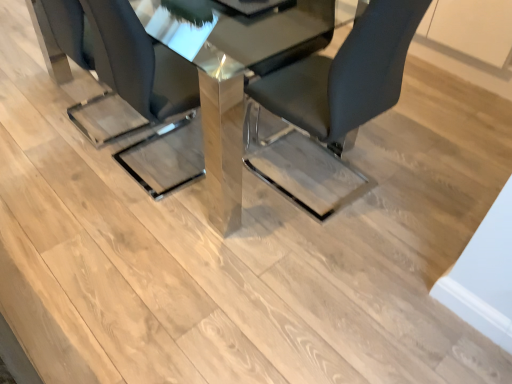
Question: Is matte black chair at center, arranged as the 1th chair when viewed from the left, at the left side of black leather chair at center, which ranks as the second chair in left-to-right order?

Choices:
 (A) yes
 (B) no

Answer: (A)

Question: Is black leather chair at center, which ranks as the second chair in left-to-right order, located within matte black chair at center, which appears as the 2th chair when viewed from the right?

Choices:
 (A) no
 (B) yes

Answer: (A)

Question: Does matte black chair at center, which appears as the 2th chair when viewed from the right, have a lesser height compared to black leather chair at center, which ranks as the 1th chair in right-to-left order?

Choices:
 (A) yes
 (B) no

Answer: (A)

Question: Is there a large distance between matte black chair at center, arranged as the 1th chair when viewed from the left, and black leather chair at center, which ranks as the second chair in left-to-right order?

Choices:
 (A) yes
 (B) no

Answer: (B)

Question: Can you confirm if matte black chair at center, which appears as the 2th chair when viewed from the right, is wider than black leather chair at center, which ranks as the second chair in left-to-right order?

Choices:
 (A) yes
 (B) no

Answer: (A)

Question: Is polished glass table at center taller or shorter than black leather chair at center, which ranks as the second chair in left-to-right order?

Choices:
 (A) short
 (B) tall

Answer: (A)

Question: From a real-world perspective, is polished glass table at center physically located above or below black leather chair at center, which ranks as the second chair in left-to-right order?

Choices:
 (A) below
 (B) above

Answer: (A)

Question: Would you say polished glass table at center is inside or outside black leather chair at center, which ranks as the 1th chair in right-to-left order?

Choices:
 (A) outside
 (B) inside

Answer: (A)

Question: Would you say polished glass table at center is to the left or to the right of black leather chair at center, which ranks as the 1th chair in right-to-left order, in the picture?

Choices:
 (A) left
 (B) right

Answer: (A)

Question: Is matte black chair at center, arranged as the 1th chair when viewed from the left, taller or shorter than polished glass table at center?

Choices:
 (A) short
 (B) tall

Answer: (B)

Question: Is matte black chair at center, arranged as the 1th chair when viewed from the left, wider or thinner than polished glass table at center?

Choices:
 (A) wide
 (B) thin

Answer: (B)

Question: Considering the positions of matte black chair at center, which appears as the 2th chair when viewed from the right, and polished glass table at center in the image, is matte black chair at center, which appears as the 2th chair when viewed from the right, bigger or smaller than polished glass table at center?

Choices:
 (A) big
 (B) small

Answer: (B)

Question: Choose the correct answer: Is matte black chair at center, which appears as the 2th chair when viewed from the right, inside polished glass table at center or outside it?

Choices:
 (A) outside
 (B) inside

Answer: (B)

Question: In terms of height, does polished glass table at center look taller or shorter compared to matte black chair at center, which appears as the 2th chair when viewed from the right?

Choices:
 (A) short
 (B) tall

Answer: (A)

Question: From a real-world perspective, relative to matte black chair at center, which appears as the 2th chair when viewed from the right, is polished glass table at center vertically above or below?

Choices:
 (A) above
 (B) below

Answer: (B)